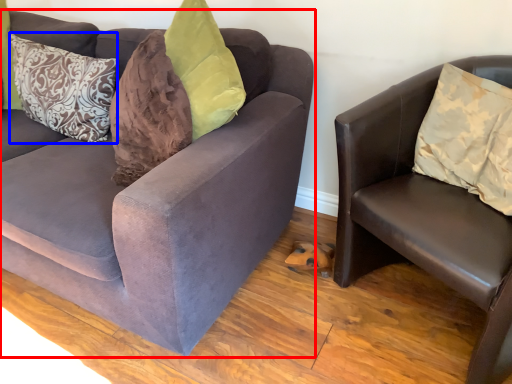
Question: Which point is closer to the camera, studio couch (highlighted by a red box) or pillow (highlighted by a blue box)?

Choices:
 (A) studio couch
 (B) pillow

Answer: (A)